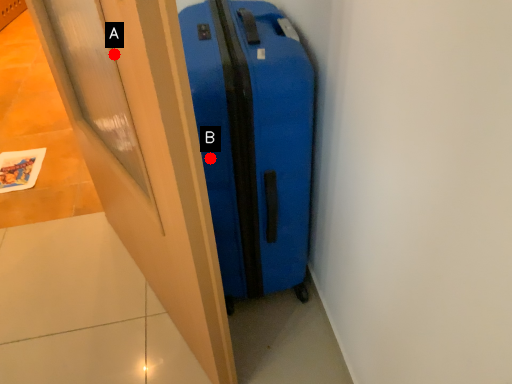
Question: Two points are circled on the image, labeled by A and B beside each circle. Which of the following is the closest to the observer?

Choices:
 (A) A is closer
 (B) B is closer

Answer: (A)